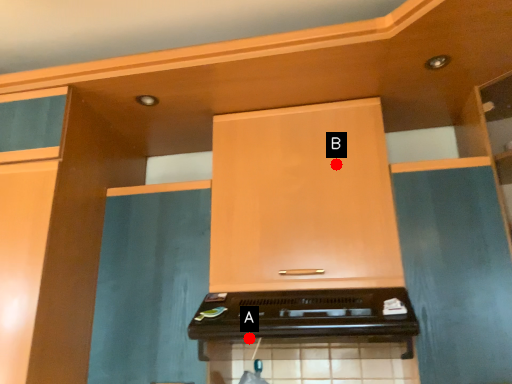
Question: Two points are circled on the image, labeled by A and B beside each circle. Which point is farther to the camera?

Choices:
 (A) A is further
 (B) B is further

Answer: (B)